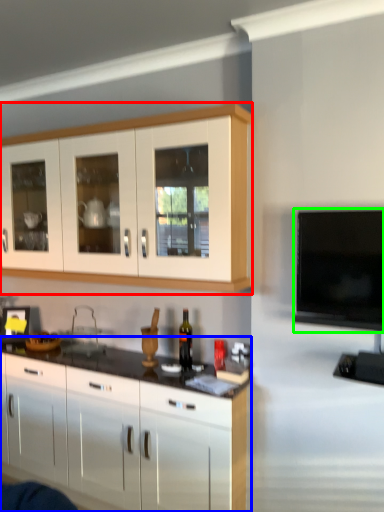
Question: Which is farther away from cabinetry (highlighted by a red box)? cabinetry (highlighted by a blue box) or television (highlighted by a green box)?

Choices:
 (A) cabinetry
 (B) television

Answer: (A)